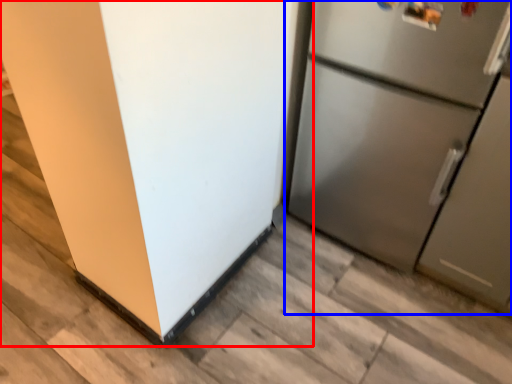
Question: Which object appears closest to the camera in this image, refrigerator (highlighted by a red box) or refrigerator (highlighted by a blue box)?

Choices:
 (A) refrigerator
 (B) refrigerator

Answer: (A)